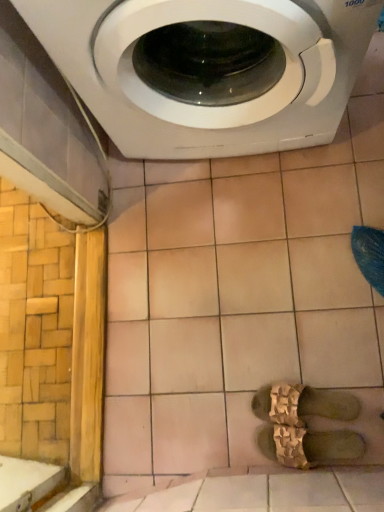
The height and width of the screenshot is (512, 384). What are the coordinates of `free point to the left of gold textured sandals at center, which appears as the 2th shoe when ordered from the bottom` in the screenshot? It's located at (223, 430).